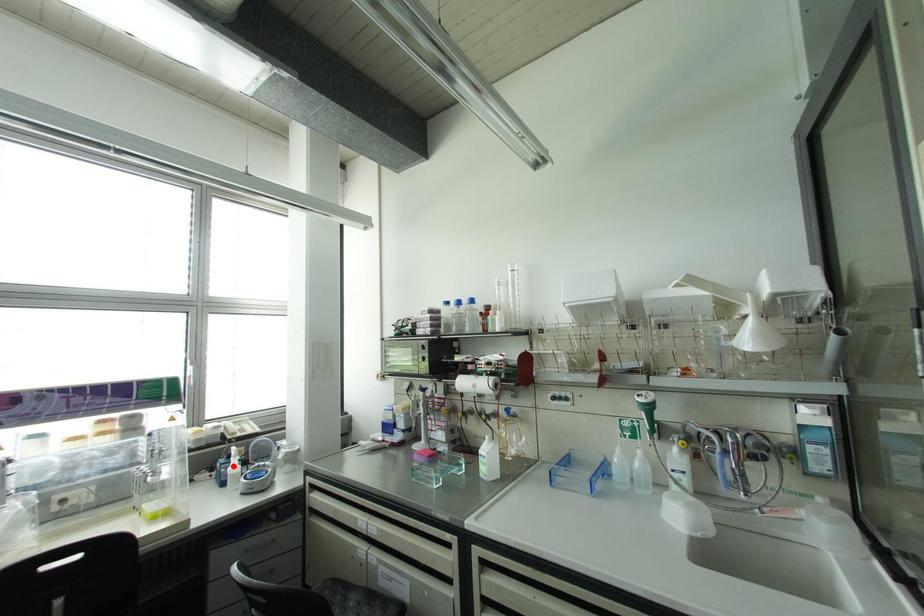
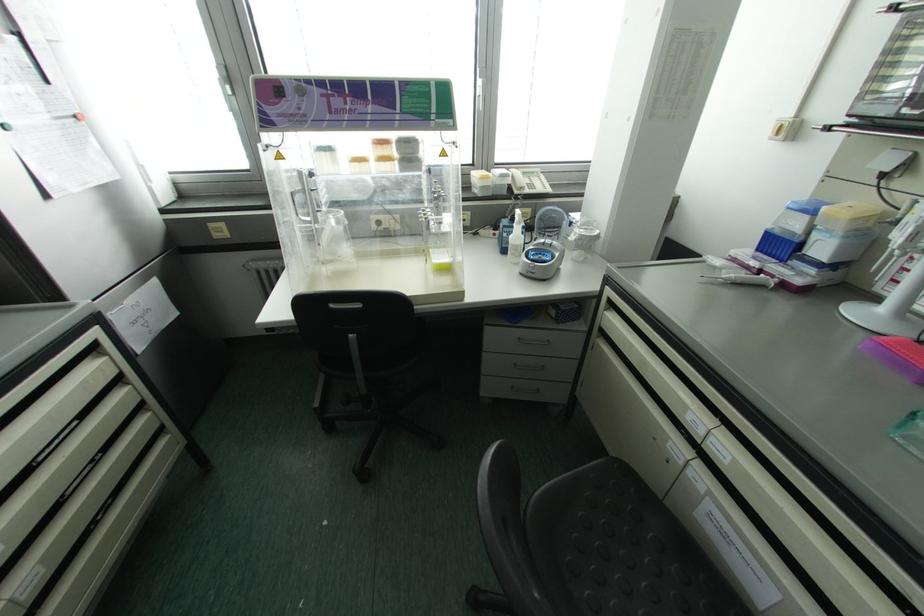
The point at the highlighted location is marked in the first image. Where is the corresponding point in the second image?

(516, 235)